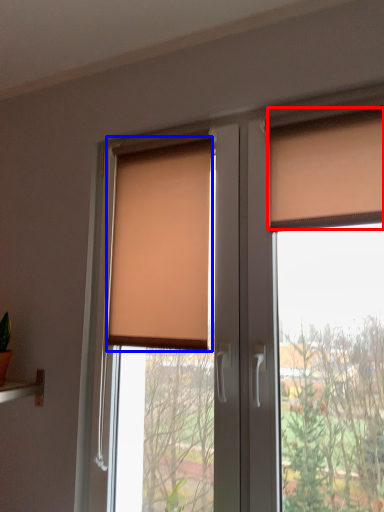
Question: Which object appears closest to the camera in this image, curtain (highlighted by a red box) or window blind (highlighted by a blue box)?

Choices:
 (A) curtain
 (B) window blind

Answer: (A)